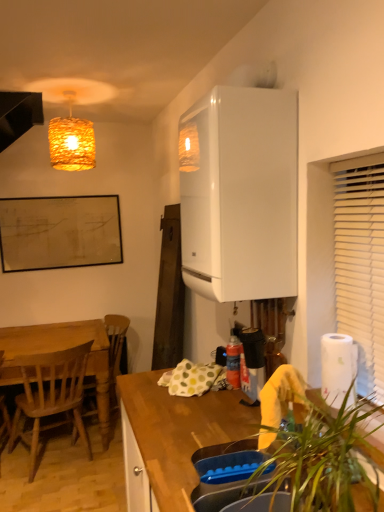
Question: Considering the relative sizes of white paper at right and white glossy boiler at upper right in the image provided, is white paper at right bigger than white glossy boiler at upper right?

Choices:
 (A) no
 (B) yes

Answer: (A)

Question: Can you confirm if white paper at right is taller than white glossy boiler at upper right?

Choices:
 (A) yes
 (B) no

Answer: (B)

Question: Is white paper at right shorter than white glossy boiler at upper right?

Choices:
 (A) yes
 (B) no

Answer: (A)

Question: Is white paper at right positioned before white glossy boiler at upper right?

Choices:
 (A) no
 (B) yes

Answer: (B)

Question: Is white paper at right located outside white glossy boiler at upper right?

Choices:
 (A) yes
 (B) no

Answer: (A)

Question: Is white paper at right looking in the opposite direction of white glossy boiler at upper right?

Choices:
 (A) yes
 (B) no

Answer: (B)

Question: Does black matte exhaust hood at upper left have a lesser width compared to white glossy boiler at upper right?

Choices:
 (A) yes
 (B) no

Answer: (A)

Question: Is black matte exhaust hood at upper left taller than white glossy boiler at upper right?

Choices:
 (A) yes
 (B) no

Answer: (B)

Question: Considering the relative sizes of black matte exhaust hood at upper left and white glossy boiler at upper right in the image provided, is black matte exhaust hood at upper left bigger than white glossy boiler at upper right?

Choices:
 (A) no
 (B) yes

Answer: (A)

Question: Considering the relative positions of black matte exhaust hood at upper left and white glossy boiler at upper right in the image provided, is black matte exhaust hood at upper left to the left of white glossy boiler at upper right from the viewer's perspective?

Choices:
 (A) yes
 (B) no

Answer: (A)

Question: Could you tell me if black matte exhaust hood at upper left is turned towards white glossy boiler at upper right?

Choices:
 (A) no
 (B) yes

Answer: (A)

Question: From the image's perspective, is black matte exhaust hood at upper left on top of white glossy boiler at upper right?

Choices:
 (A) yes
 (B) no

Answer: (A)

Question: Are white paper at right and woven straw lampshade at upper left far apart?

Choices:
 (A) no
 (B) yes

Answer: (B)